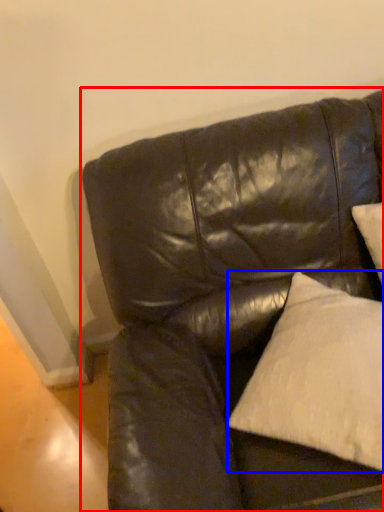
Question: Which of the following is the farthest to the observer, studio couch (highlighted by a red box) or pillow (highlighted by a blue box)?

Choices:
 (A) studio couch
 (B) pillow

Answer: (B)